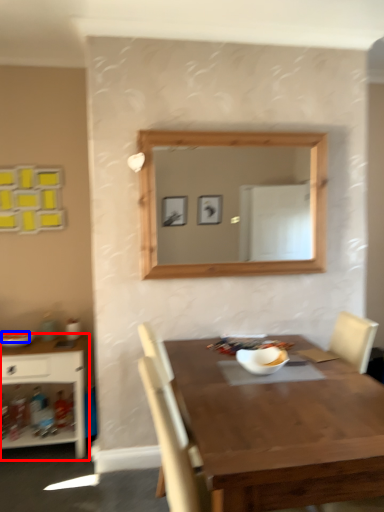
Question: Which object is closer to the camera taking this photo, shelf (highlighted by a red box) or food (highlighted by a blue box)?

Choices:
 (A) shelf
 (B) food

Answer: (A)